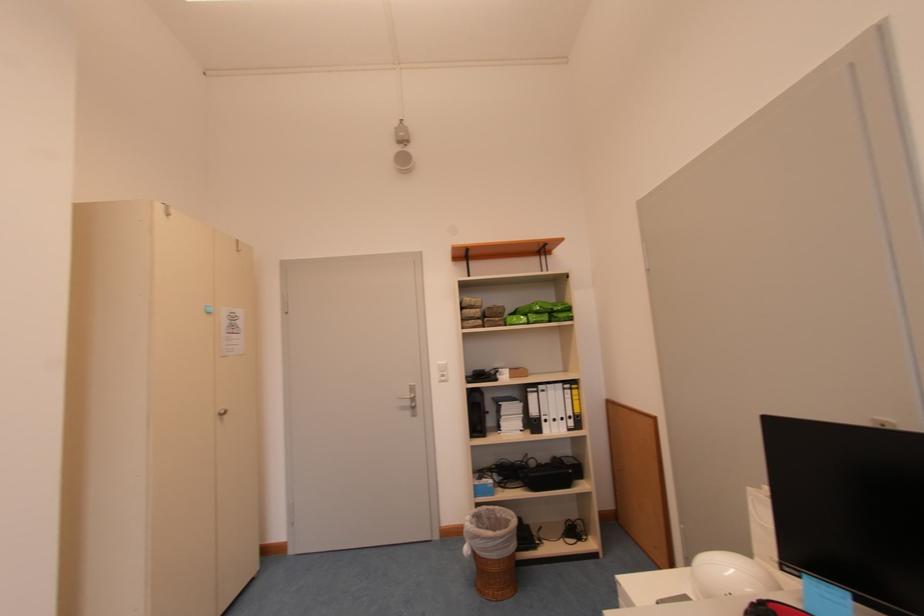
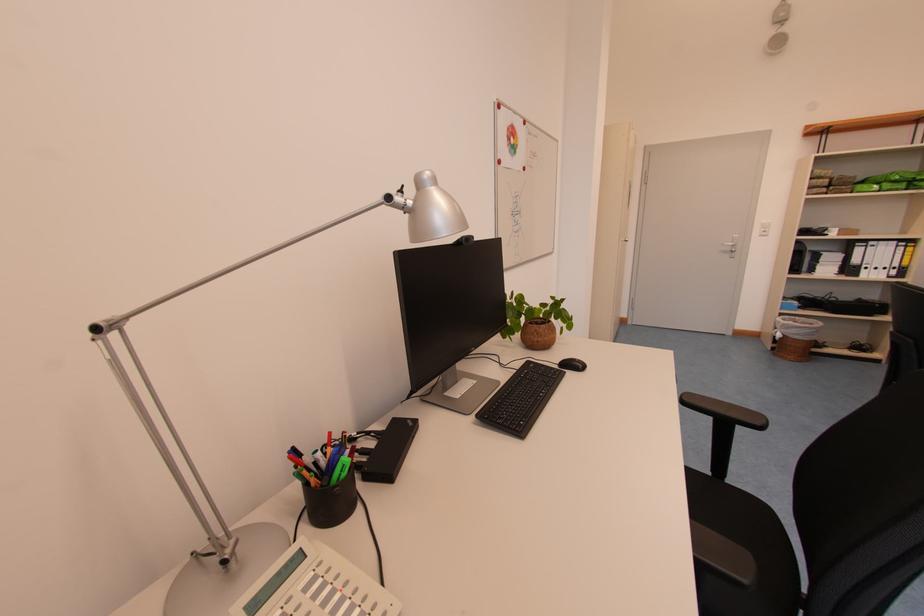
Locate, in the second image, the point that corresponds to [415,406] in the first image.

(736, 252)